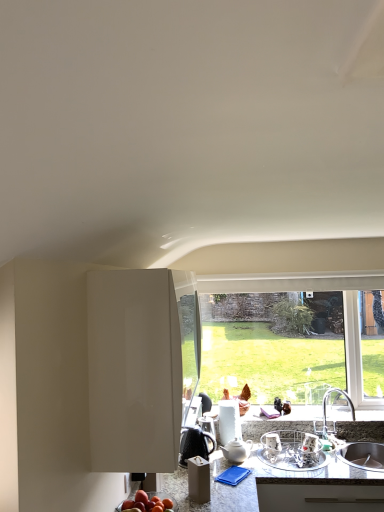
Question: From the image's perspective, would you say black glossy coffee pot at center, which ranks as the 1th appliance in left-to-right order, is positioned over white glossy cabinet at center?

Choices:
 (A) no
 (B) yes

Answer: (A)

Question: Could you tell me if black glossy coffee pot at center, which ranks as the 1th appliance in left-to-right order, is facing white glossy cabinet at center?

Choices:
 (A) yes
 (B) no

Answer: (B)

Question: From the image's perspective, does black glossy coffee pot at center, acting as the second appliance starting from the right, appear lower than white glossy cabinet at center?

Choices:
 (A) yes
 (B) no

Answer: (A)

Question: From a real-world perspective, does black glossy coffee pot at center, which ranks as the 1th appliance in left-to-right order, stand above white glossy cabinet at center?

Choices:
 (A) no
 (B) yes

Answer: (A)

Question: Is white glossy cabinet at center located within black glossy coffee pot at center, acting as the second appliance starting from the right?

Choices:
 (A) yes
 (B) no

Answer: (B)

Question: Does black glossy coffee pot at center, which ranks as the 1th appliance in left-to-right order, appear on the right side of white glossy cabinet at center?

Choices:
 (A) yes
 (B) no

Answer: (A)

Question: Could you tell me if shiny red apple at lower center is turned towards metallic silver dish rack at center, the 1th appliance viewed from the right?

Choices:
 (A) no
 (B) yes

Answer: (A)

Question: Can you confirm if shiny red apple at lower center is thinner than metallic silver dish rack at center, the 1th appliance viewed from the right?

Choices:
 (A) yes
 (B) no

Answer: (A)

Question: Is shiny red apple at lower center to the right of metallic silver dish rack at center, the 1th appliance viewed from the right, from the viewer's perspective?

Choices:
 (A) yes
 (B) no

Answer: (B)

Question: Is shiny red apple at lower center closer to camera compared to metallic silver dish rack at center, arranged as the 2th appliance when viewed from the left?

Choices:
 (A) no
 (B) yes

Answer: (B)

Question: Considering the relative positions of shiny red apple at lower center and metallic silver dish rack at center, the 1th appliance viewed from the right, in the image provided, is shiny red apple at lower center behind metallic silver dish rack at center, the 1th appliance viewed from the right,?

Choices:
 (A) no
 (B) yes

Answer: (A)

Question: Is shiny red apple at lower center turned away from metallic silver dish rack at center, arranged as the 2th appliance when viewed from the left?

Choices:
 (A) no
 (B) yes

Answer: (A)

Question: Is white glossy cabinet at center further to the viewer compared to granite gray countertop at lower center?

Choices:
 (A) yes
 (B) no

Answer: (B)